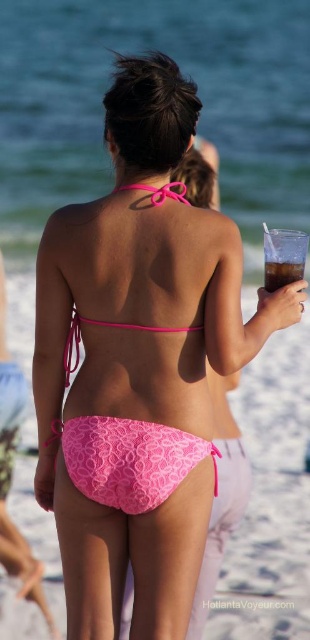
Question: Which of these objects is positioned farthest from the pink lace bikini at center?

Choices:
 (A) pink lace bikini top at upper center
 (B) translucent plastic cup at upper right

Answer: (A)

Question: Considering the real-world distances, which object is closest to the pink lace bikini top at upper center?

Choices:
 (A) translucent plastic cup at upper right
 (B) pink lace bikini at center

Answer: (A)

Question: Can you confirm if translucent plastic cup at upper right is smaller than pink lace bikini top at upper center?

Choices:
 (A) yes
 (B) no

Answer: (A)

Question: Is translucent plastic cup at upper right bigger than pink lace bikini top at upper center?

Choices:
 (A) no
 (B) yes

Answer: (A)

Question: Is pink lace bikini at center bigger than translucent plastic cup at upper right?

Choices:
 (A) yes
 (B) no

Answer: (A)

Question: Which object appears closest to the camera in this image?

Choices:
 (A) pink lace bikini top at upper center
 (B) pink lace bikini at center

Answer: (B)